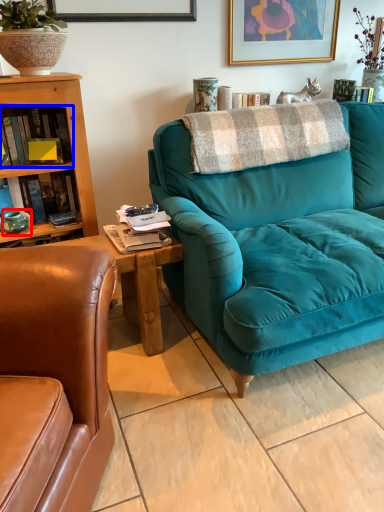
Question: Which point is further to the camera, teal (highlighted by a red box) or book (highlighted by a blue box)?

Choices:
 (A) teal
 (B) book

Answer: (A)